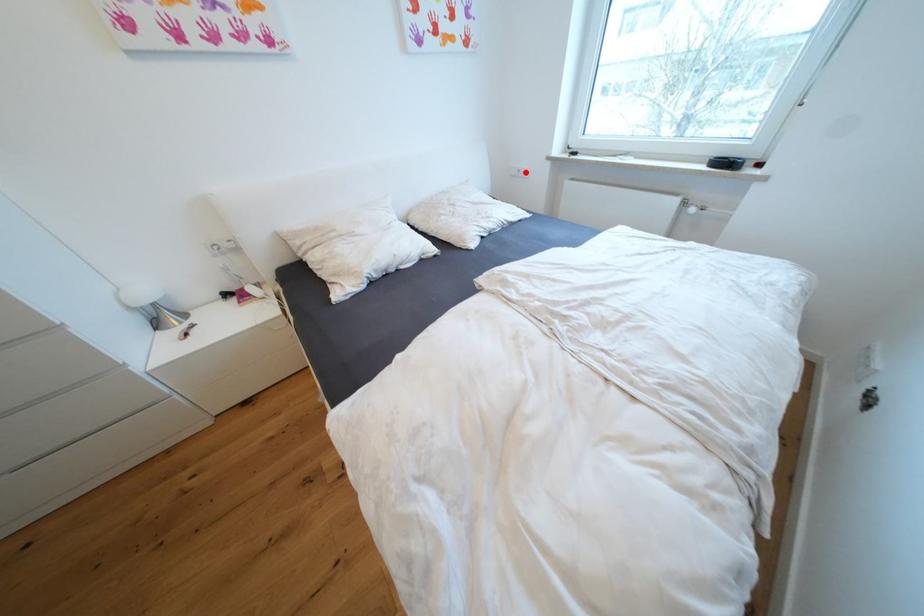
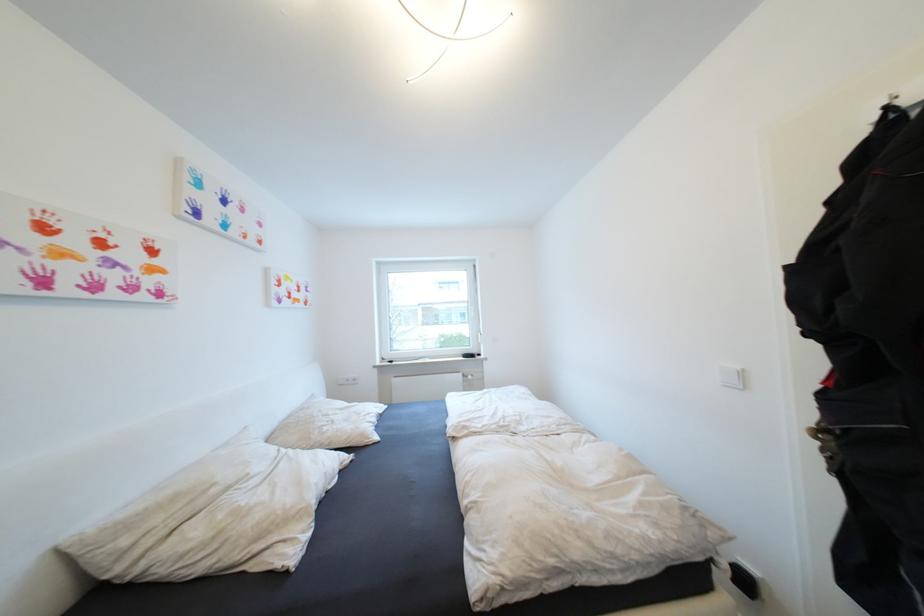
The point at the highlighted location is marked in the first image. Where is the corresponding point in the second image?

(355, 381)